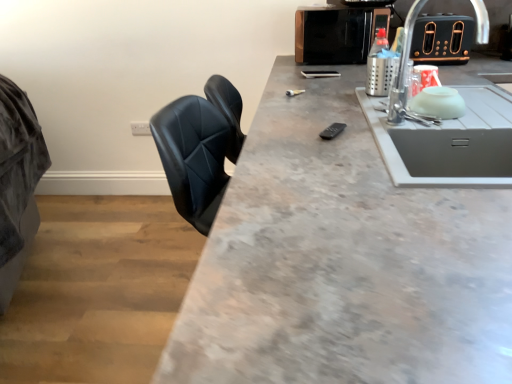
Question: Relative to metallic silver bottle at upper right, is white plastic electric outlet at upper center in front or behind?

Choices:
 (A) behind
 (B) front

Answer: (A)

Question: In terms of size, does white plastic electric outlet at upper center appear bigger or smaller than metallic silver bottle at upper right?

Choices:
 (A) small
 (B) big

Answer: (A)

Question: Which is nearer to the metallic microwave at upper right, which appears as the 2th appliance when viewed from the right?

Choices:
 (A) white plastic electric outlet at upper center
 (B) white matte sink at right
 (C) black metallic toaster at upper right, the second appliance in the left-to-right sequence
 (D) metallic silver bottle at upper right
 (E) gray concrete countertop at center

Answer: (D)

Question: Estimate the real-world distances between objects in this image. Which object is farther from the metallic microwave at upper right, which appears as the 2th appliance when viewed from the right?

Choices:
 (A) white matte sink at right
 (B) white plastic electric outlet at upper center
 (C) black metallic toaster at upper right, which ranks as the 1th appliance in right-to-left order
 (D) metallic silver bottle at upper right
 (E) gray concrete countertop at center

Answer: (B)